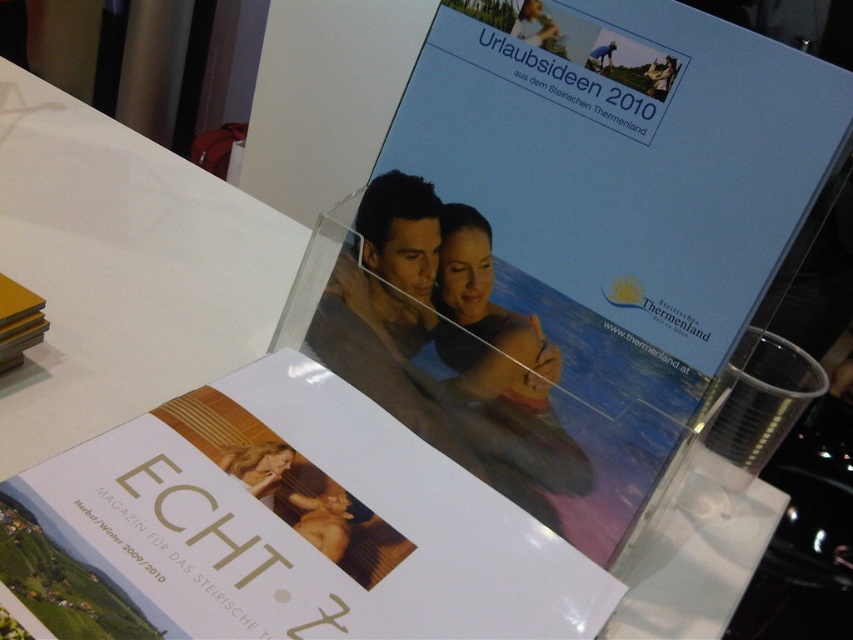
What is the relationship between the sizes of the white paper at upper left and the blonde hair at center?

The white paper at upper left is wider than the blonde hair at center.

What are the coordinates of the white paper at upper left?

The white paper at upper left is located at point (122, 269).

You are a photographer standing at the exhibition booth and want to capture both the white paper at upper left and the blonde hair at center in a single photo. Given that your camera has a maximum focus range of 30 centimeters, will you be able to include both objects in the photo without moving the camera?

The white paper at upper left and the blonde hair at center are 31.11 centimeters apart from each other. Since the distance between them exceeds the camera maximum focus range of 30 centimeters, you will not be able to include both objects in the photo without moving the camera.